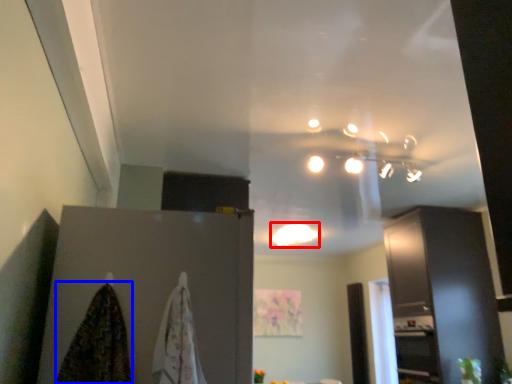
Question: Which object appears closest to the camera in this image, lighting (highlighted by a red box) or blanket (highlighted by a blue box)?

Choices:
 (A) lighting
 (B) blanket

Answer: (B)